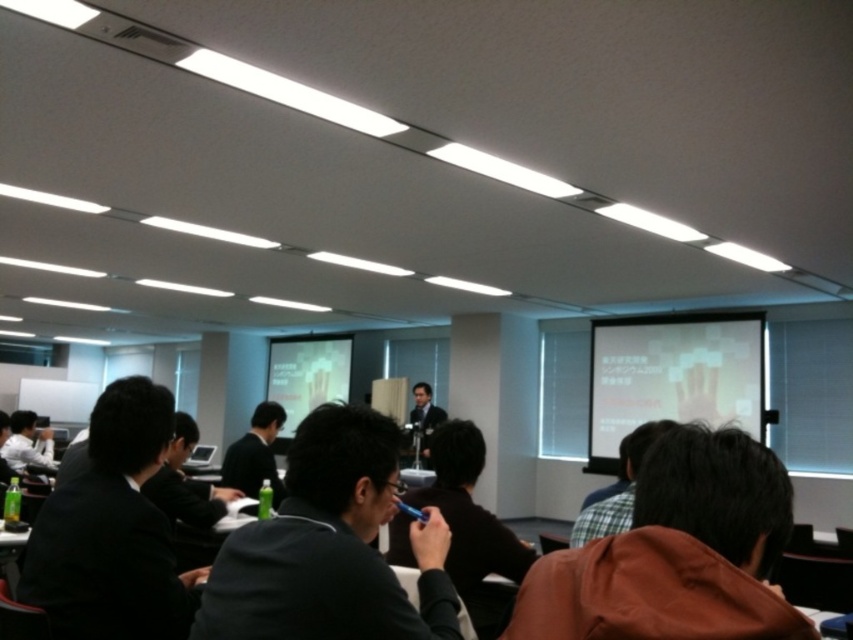
Question: Which point is farther to the camera?

Choices:
 (A) white shirt at left
 (B) matte white projector screen at center
 (C) white matte projection screen at upper center

Answer: (B)

Question: Does brown fabric jacket at lower right have a lesser width compared to black matte jacket at center?

Choices:
 (A) yes
 (B) no

Answer: (A)

Question: Can you confirm if brown fabric jacket at lower right is bigger than black matte jacket at center?

Choices:
 (A) yes
 (B) no

Answer: (B)

Question: Among these points, which one is farthest from the camera?

Choices:
 (A) (73, 586)
 (B) (317, 579)

Answer: (A)

Question: Among these objects, which one is nearest to the camera?

Choices:
 (A) white shirt at left
 (B) matte white projector screen at center

Answer: (A)

Question: Is brown fabric jacket at lower right smaller than matte white projector screen at center?

Choices:
 (A) yes
 (B) no

Answer: (A)